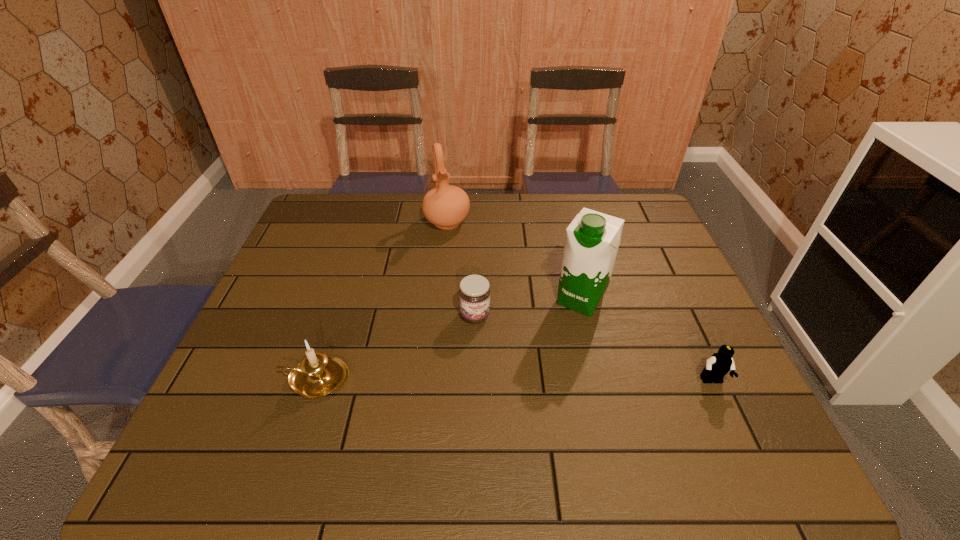
This screenshot has width=960, height=540. In the image, there is a desktop. Find the location of `vacant region at the far right corner`. vacant region at the far right corner is located at coordinates (635, 196).

Identify the location of vacant space at the near right corner. The width and height of the screenshot is (960, 540). (x=706, y=394).

The image size is (960, 540). Find the location of `vacant space that is in between the jam and the second object from right to left`. vacant space that is in between the jam and the second object from right to left is located at coordinates click(x=528, y=307).

At what (x,y) coordinates should I click in order to perform the action: click on free space between the jam and the Lego. Please return your answer as a coordinate pair (x, y). This screenshot has width=960, height=540. Looking at the image, I should click on pyautogui.click(x=593, y=348).

This screenshot has height=540, width=960. What are the coordinates of `free space between the pottery and the second object from right to left` in the screenshot? It's located at (514, 261).

Image resolution: width=960 pixels, height=540 pixels. What are the coordinates of `empty location between the jam and the farthest object` in the screenshot? It's located at (461, 269).

Locate an element on the screen. The height and width of the screenshot is (540, 960). vacant area that lies between the jam and the pottery is located at coordinates (461, 269).

You are a GUI agent. You are given a task and a screenshot of the screen. Output one action in this format:
    pyautogui.click(x=<x>, y=<y>)
    Task: Click on the free space that is in between the leftmost object and the farthest object
    This screenshot has height=540, width=960.
    Given the screenshot: What is the action you would take?
    pyautogui.click(x=381, y=300)

Find the location of a particular element. Image resolution: width=960 pixels, height=540 pixels. free spot between the farthest object and the jam is located at coordinates (461, 269).

Locate an element on the screen. The height and width of the screenshot is (540, 960). free point between the jam and the fourth object from left to right is located at coordinates (528, 307).